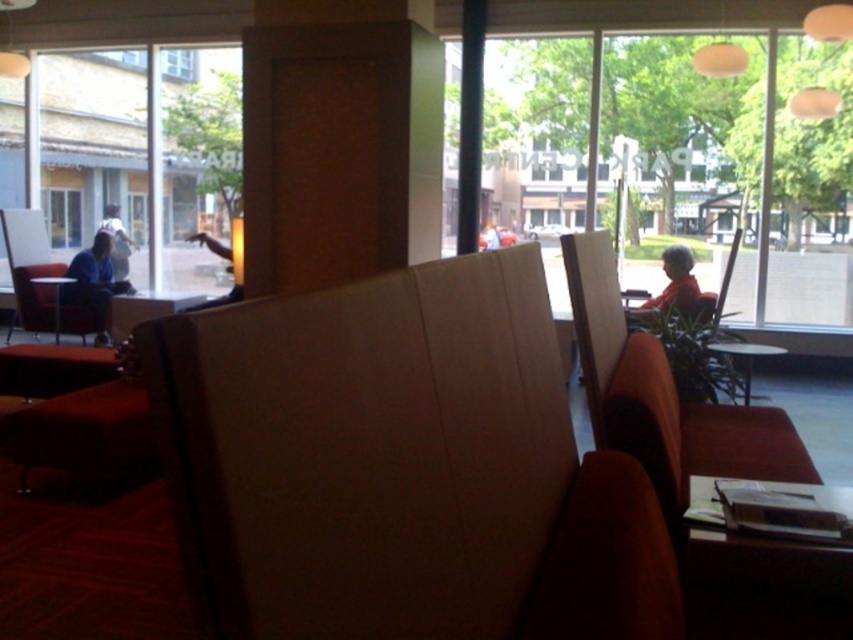
You are a delivery person who needs to place a package between the blue fabric jacket at left and the white cotton shirt at left. Can you fit the package, which is 1 meter long, in the space between them?

The distance between the blue fabric jacket at left and the white cotton shirt at left is 87.43 centimeters. Since the package is 1 meter long, which is longer than the available space, it cannot fit between them.

You are a person sitting in the booth with the high backrest. You notice a blue fabric jacket at left and a matte red shirt at right. Which clothing item appears taller from your seated position?

The blue fabric jacket at left appears taller than the matte red shirt at right from your seated position because the blue fabric jacket at left is much taller as matte red shirt at right.

You are standing at point [114,230] and want to reach the exit located at the opposite corner of the room. The room is rectangular. What is the minimum distance you need to walk to reach the exit?

The minimum distance you need to walk to reach the exit is 8.13 meters.